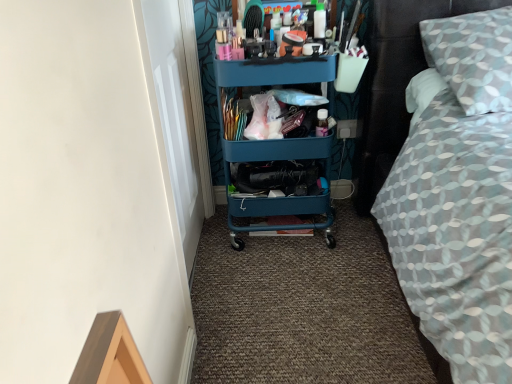
This screenshot has height=384, width=512. Describe the element at coordinates (459, 199) in the screenshot. I see `patterned fabric bed at right` at that location.

Locate an element on the screen. This screenshot has width=512, height=384. patterned fabric bed at right is located at coordinates (459, 199).

In order to face patterned fabric bed at right, should I rotate leftwards or rightwards?

Turn right approximately 28.283 degrees to face it.

Identify the location of teal plastic cart at center. (276, 151).

What do you see at coordinates (276, 151) in the screenshot?
I see `teal plastic cart at center` at bounding box center [276, 151].

At what (x,y) coordinates should I click in order to perform the action: click on patterned fabric bed at right. Please return your answer as a coordinate pair (x, y). The height and width of the screenshot is (384, 512). Looking at the image, I should click on (459, 199).

Is teal plastic cart at center to the right of patterned fabric bed at right from the viewer's perspective?

No, teal plastic cart at center is not to the right of patterned fabric bed at right.

Which object is further away from the camera, teal plastic cart at center or patterned fabric bed at right?

teal plastic cart at center is further from the camera.

Is point (291, 178) positioned in front of point (425, 188)?

That is False.

From the image's perspective, between teal plastic cart at center and patterned fabric bed at right, who is located below?

teal plastic cart at center is shown below in the image.

From a real-world perspective, is teal plastic cart at center positioned under patterned fabric bed at right based on gravity?

Yes.

Considering the relative sizes of teal plastic cart at center and patterned fabric bed at right in the image provided, is teal plastic cart at center wider than patterned fabric bed at right?

No, teal plastic cart at center is not wider than patterned fabric bed at right.

Considering the sizes of objects teal plastic cart at center and patterned fabric bed at right in the image provided, who is taller, teal plastic cart at center or patterned fabric bed at right?

teal plastic cart at center.

Considering the sizes of teal plastic cart at center and patterned fabric bed at right in the image, is teal plastic cart at center bigger or smaller than patterned fabric bed at right?

In the image, teal plastic cart at center appears to be smaller than patterned fabric bed at right.

Is teal plastic cart at center inside or outside of patterned fabric bed at right?

The correct answer is: outside.

Is teal plastic cart at center positioned far away from patterned fabric bed at right?

No, teal plastic cart at center is not far from patterned fabric bed at right.

Is teal plastic cart at center looking in the opposite direction of patterned fabric bed at right?

No.

How many degrees apart are the facing directions of teal plastic cart at center and patterned fabric bed at right?

The angular difference between teal plastic cart at center and patterned fabric bed at right is 1.61 degrees.

Locate an element on the screen. The width and height of the screenshot is (512, 384). bed in front of the teal plastic cart at center is located at coordinates (459, 199).

Which object is positioned more to the left, patterned fabric bed at right or teal plastic cart at center?

Positioned to the left is teal plastic cart at center.

Is patterned fabric bed at right positioned in front of teal plastic cart at center?

Yes, it is.

Is point (503, 64) closer or farther from the camera than point (229, 151)?

Clearly, point (503, 64) is closer to the camera than point (229, 151).

From the image's perspective, which one is positioned higher, patterned fabric bed at right or teal plastic cart at center?

patterned fabric bed at right appears higher in the image.

From the picture: From a real-world perspective, is patterned fabric bed at right located higher than teal plastic cart at center?

Correct, in the physical world, patterned fabric bed at right is higher than teal plastic cart at center.

Which object is thinner, patterned fabric bed at right or teal plastic cart at center?

teal plastic cart at center is thinner.

Considering the relative sizes of patterned fabric bed at right and teal plastic cart at center in the image provided, is patterned fabric bed at right shorter than teal plastic cart at center?

Yes.

Between patterned fabric bed at right and teal plastic cart at center, which one has smaller size?

teal plastic cart at center is smaller.

Would you say patterned fabric bed at right is outside teal plastic cart at center?

Yes.

Is patterned fabric bed at right placed right next to teal plastic cart at center?

No, patterned fabric bed at right is not in contact with teal plastic cart at center.

Could you tell me if patterned fabric bed at right is turned towards teal plastic cart at center?

No.

Can you tell me how much patterned fabric bed at right and teal plastic cart at center differ in facing direction?

There is a 1.61-degree angle between the facing directions of patterned fabric bed at right and teal plastic cart at center.

Identify the location of bed on the right of teal plastic cart at center. (459, 199).

The image size is (512, 384). What are the coordinates of `shelf that appears on the left of patterned fabric bed at right` in the screenshot? It's located at (276, 151).

This screenshot has height=384, width=512. Find the location of `bed in front of the teal plastic cart at center`. bed in front of the teal plastic cart at center is located at coordinates (459, 199).